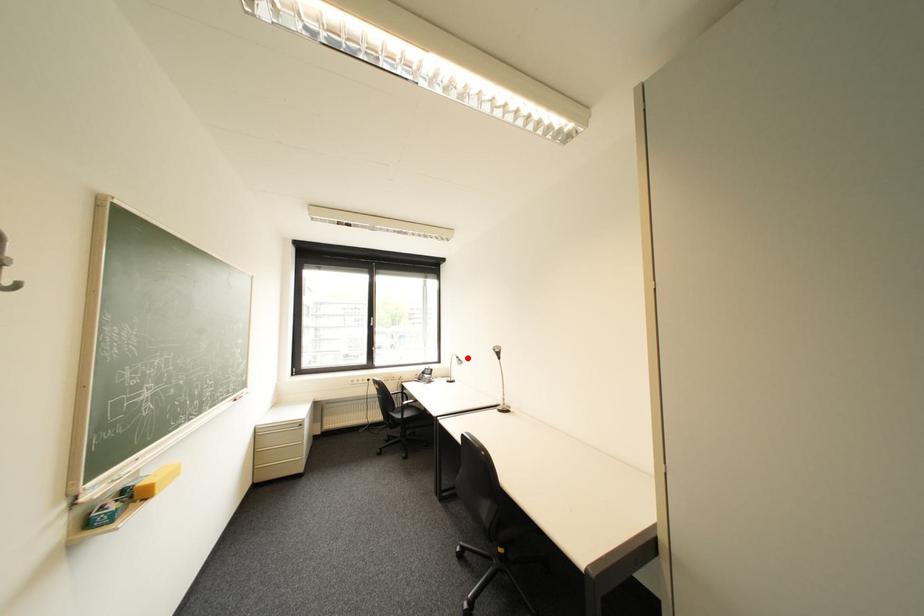
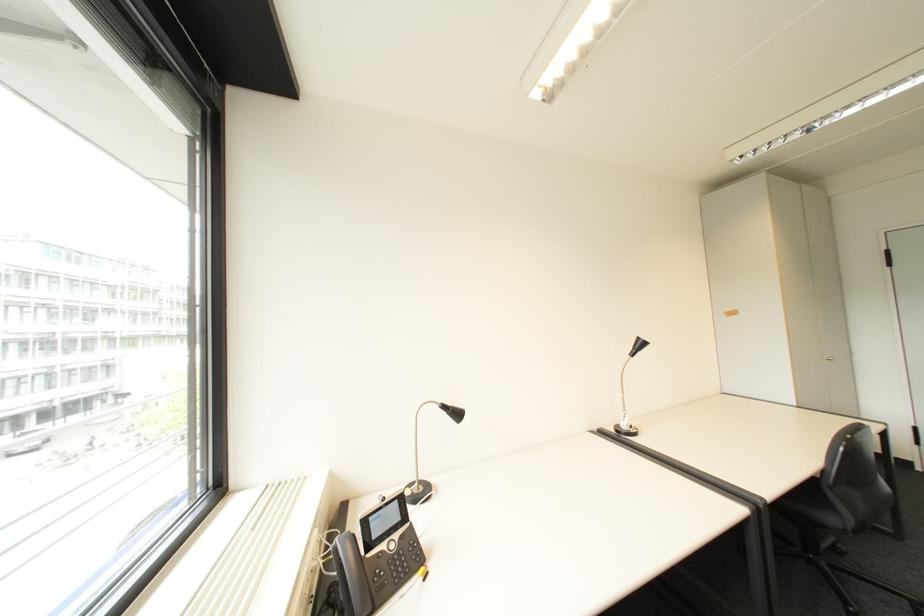
Locate, in the second image, the point that corresponds to the highlighted location in the first image.

(455, 407)